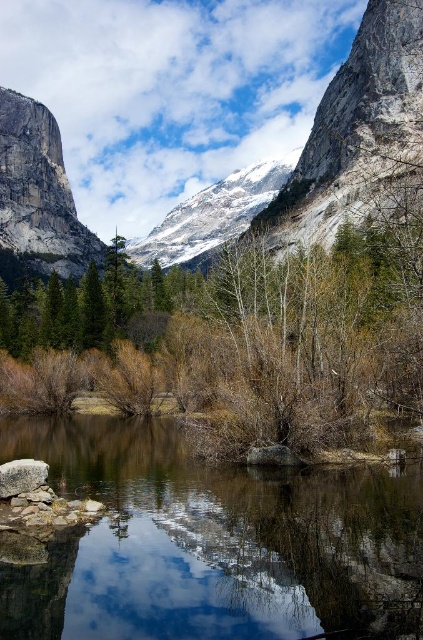
You are standing at the edge of the lake and see the clear water at center and the gray rough stone at lower left. Which object takes up more space in the image?

The clear water at center takes up more space in the image because it is bigger than the gray rough stone at lower left.

Based on the scene description, what is located at the coordinates point (186, 96)?

The gray stone mountain at center is located at point (186, 96).

You are standing at the edge of the lake and notice the clear water at center and the gray rough stone at lower left. Which object is located closer to your current position?

The gray rough stone at lower left is closer to your current position because it is positioned above the clear water at center, which is beneath it.